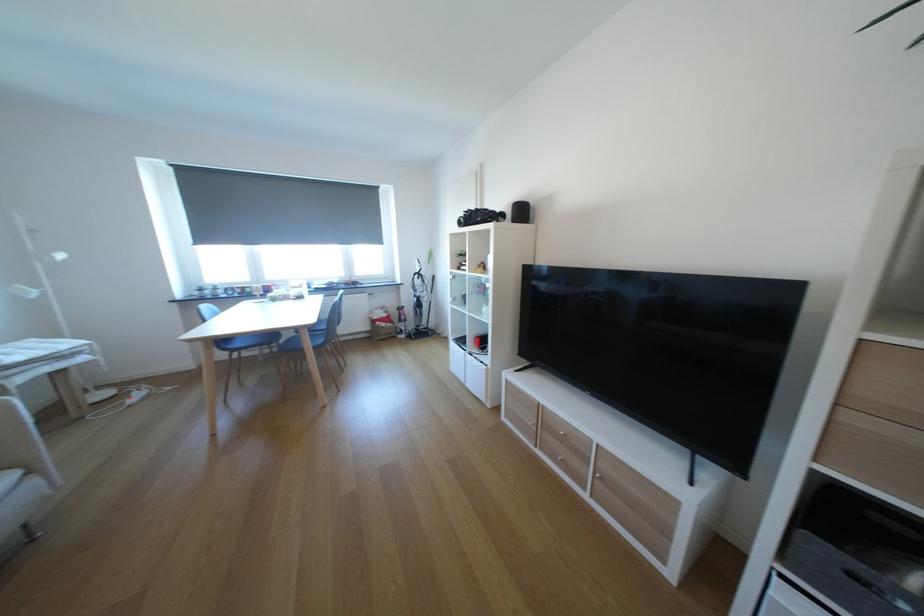
Where is `black toy vehicle`? The height and width of the screenshot is (616, 924). black toy vehicle is located at coordinates (480, 217).